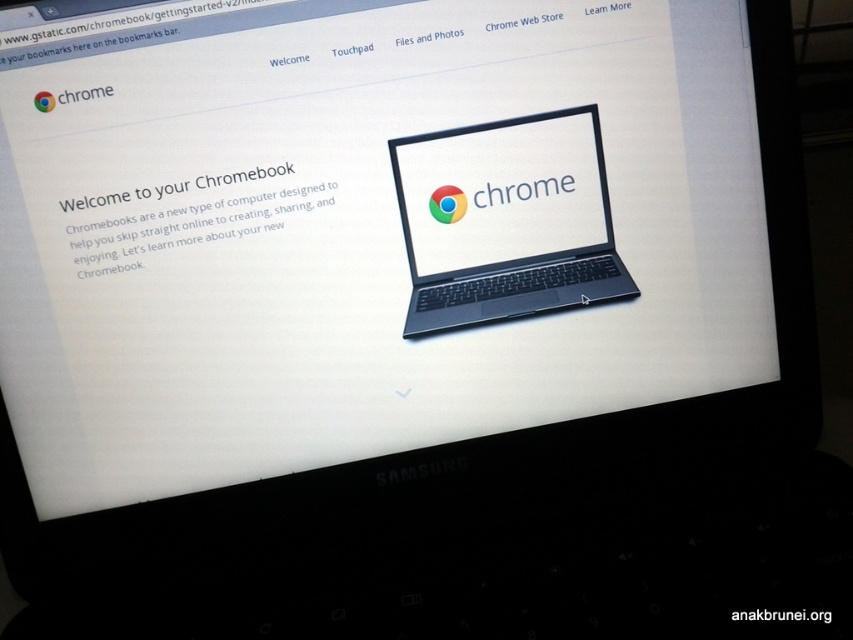
Between satin black laptop at center and white glossy laptop at center, which one appears on the left side from the viewer's perspective?

Positioned to the left is satin black laptop at center.

Can you confirm if satin black laptop at center is positioned to the left of white glossy laptop at center?

Indeed, satin black laptop at center is positioned on the left side of white glossy laptop at center.

Is point (479, 205) more distant than point (791, 609)?

Yes, it is.

I want to click on satin black laptop at center, so click(x=506, y=220).